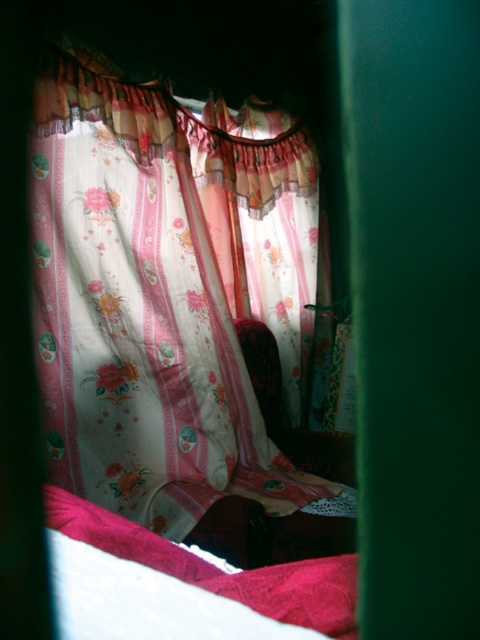
Question: Among these points, which one is farthest from the camera?

Choices:
 (A) (173, 556)
 (B) (56, 209)

Answer: (B)

Question: Considering the relative positions of floral sheer curtain at upper center and velvet red blanket at lower left in the image provided, where is floral sheer curtain at upper center located with respect to velvet red blanket at lower left?

Choices:
 (A) below
 (B) above

Answer: (B)

Question: Which point is closer to the camera?

Choices:
 (A) velvet red blanket at lower left
 (B) floral sheer curtain at upper center

Answer: (A)

Question: Can you confirm if floral sheer curtain at upper center is smaller than velvet red blanket at lower left?

Choices:
 (A) yes
 (B) no

Answer: (B)

Question: Is floral sheer curtain at upper center to the left of velvet red blanket at lower left from the viewer's perspective?

Choices:
 (A) no
 (B) yes

Answer: (B)